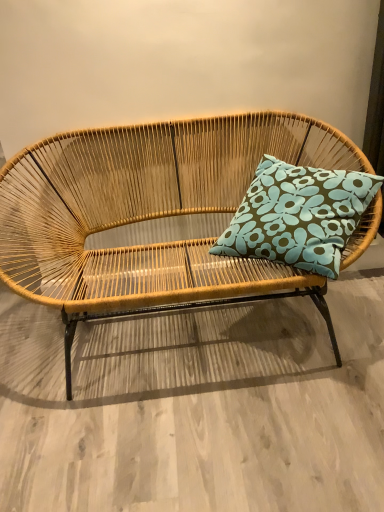
Identify the location of vacant area that is in front of natural woven studio couch at center. Image resolution: width=384 pixels, height=512 pixels. (205, 442).